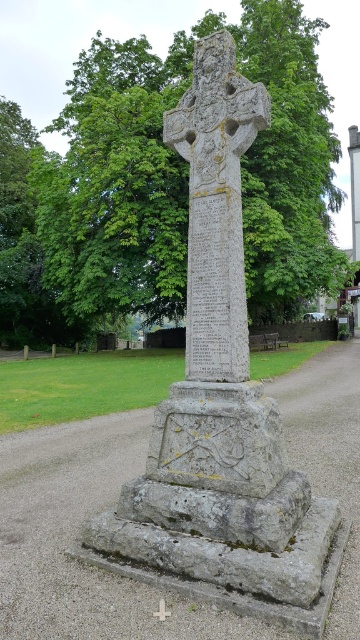
Does green leafy tree at center appear under white stone cross at center?

Incorrect, green leafy tree at center is not positioned below white stone cross at center.

Can you confirm if green leafy tree at center is positioned to the right of white stone cross at center?

Indeed, green leafy tree at center is positioned on the right side of white stone cross at center.

This screenshot has width=360, height=640. What are the coordinates of `green leafy tree at center` in the screenshot? It's located at (186, 176).

From the picture: Can you confirm if green leafy tree at center is positioned to the left of granite cross at center?

Correct, you'll find green leafy tree at center to the left of granite cross at center.

Is green leafy tree at center thinner than granite cross at center?

No.

The width and height of the screenshot is (360, 640). What do you see at coordinates (186, 176) in the screenshot? I see `green leafy tree at center` at bounding box center [186, 176].

Find the location of a particular element. Image resolution: width=360 pixels, height=640 pixels. green leafy tree at center is located at coordinates (186, 176).

Can you confirm if granite cross at center is positioned to the left of white stone cross at center?

No, granite cross at center is not to the left of white stone cross at center.

Is point (214, 380) positioned behind point (165, 609)?

That is True.

In order to click on granite cross at center in this screenshot , I will do `click(216, 205)`.